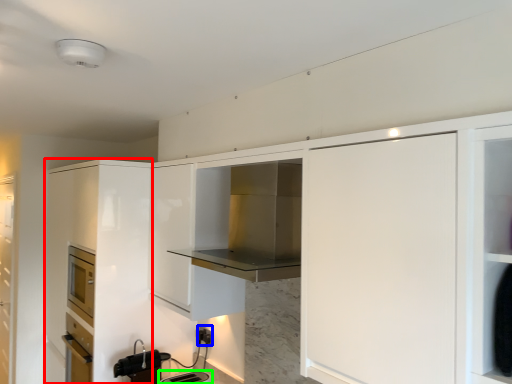
Question: Which object is positioned closest to cabinetry (highlighted by a red box)? Select from electric outlet (highlighted by a blue box) and appliance (highlighted by a green box).

Choices:
 (A) electric outlet
 (B) appliance

Answer: (A)